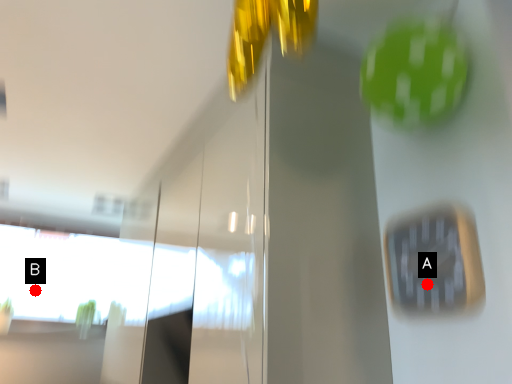
Question: Two points are circled on the image, labeled by A and B beside each circle. Which point appears closest to the camera in this image?

Choices:
 (A) A is closer
 (B) B is closer

Answer: (A)